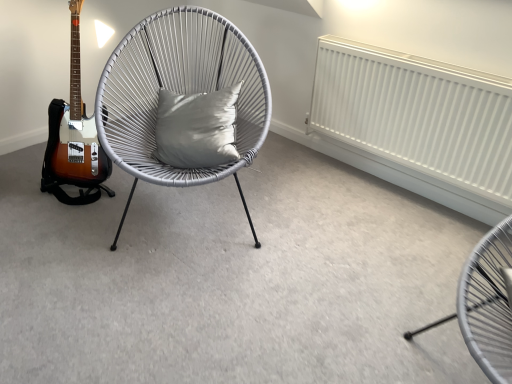
Question: Considering the relative positions of white woven chair at center, the first chair viewed from the left, and white matte radiator at upper right in the image provided, is white woven chair at center, the first chair viewed from the left, behind white matte radiator at upper right?

Choices:
 (A) no
 (B) yes

Answer: (A)

Question: Is white woven chair at center, the second chair when ordered from front to back, positioned in front of white matte radiator at upper right?

Choices:
 (A) no
 (B) yes

Answer: (B)

Question: Considering the relative positions of white woven chair at center, the second chair when ordered from front to back, and white matte radiator at upper right in the image provided, is white woven chair at center, the second chair when ordered from front to back, to the right of white matte radiator at upper right from the viewer's perspective?

Choices:
 (A) yes
 (B) no

Answer: (B)

Question: From the image's perspective, is white woven chair at center, the second chair when ordered from front to back, located above white matte radiator at upper right?

Choices:
 (A) yes
 (B) no

Answer: (B)

Question: Can you confirm if white woven chair at center, which is the first chair in back-to-front order, is smaller than white matte radiator at upper right?

Choices:
 (A) no
 (B) yes

Answer: (A)

Question: Based on their sizes in the image, would you say matte grey chair at lower right, which is the 2th chair from left to right, is bigger or smaller than white matte radiator at upper right?

Choices:
 (A) big
 (B) small

Answer: (A)

Question: Would you say matte grey chair at lower right, the 1th chair positioned from the right, is to the left or to the right of white matte radiator at upper right in the picture?

Choices:
 (A) right
 (B) left

Answer: (A)

Question: From a real-world perspective, is matte grey chair at lower right, the 1th chair positioned from the right, physically located above or below white matte radiator at upper right?

Choices:
 (A) below
 (B) above

Answer: (B)

Question: From the image's perspective, is matte grey chair at lower right, which is the first chair from front to back, above or below white matte radiator at upper right?

Choices:
 (A) above
 (B) below

Answer: (B)

Question: In terms of width, does satin gray cushion at center look wider or thinner when compared to white woven chair at center, acting as the second chair starting from the right?

Choices:
 (A) wide
 (B) thin

Answer: (B)

Question: From their relative heights in the image, would you say satin gray cushion at center is taller or shorter than white woven chair at center, the second chair when ordered from front to back?

Choices:
 (A) tall
 (B) short

Answer: (B)

Question: From the image's perspective, is satin gray cushion at center located above or below white woven chair at center, which is the first chair in back-to-front order?

Choices:
 (A) above
 (B) below

Answer: (B)

Question: Is point (175, 157) closer or farther from the camera than point (136, 125)?

Choices:
 (A) farther
 (B) closer

Answer: (B)

Question: Considering the positions of white matte radiator at upper right and satin gray cushion at center in the image, is white matte radiator at upper right bigger or smaller than satin gray cushion at center?

Choices:
 (A) big
 (B) small

Answer: (A)

Question: Based on their positions, is white matte radiator at upper right located to the left or right of satin gray cushion at center?

Choices:
 (A) left
 (B) right

Answer: (B)